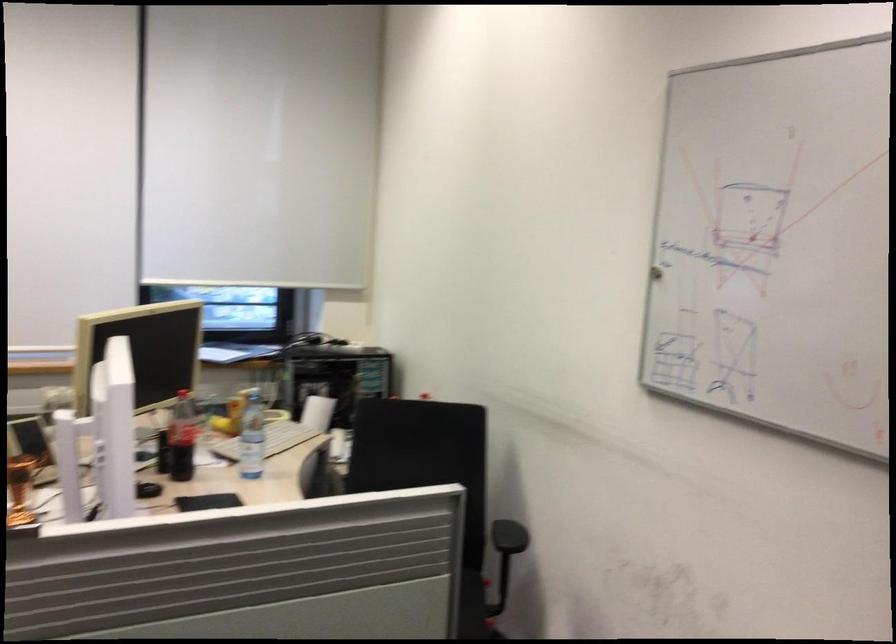
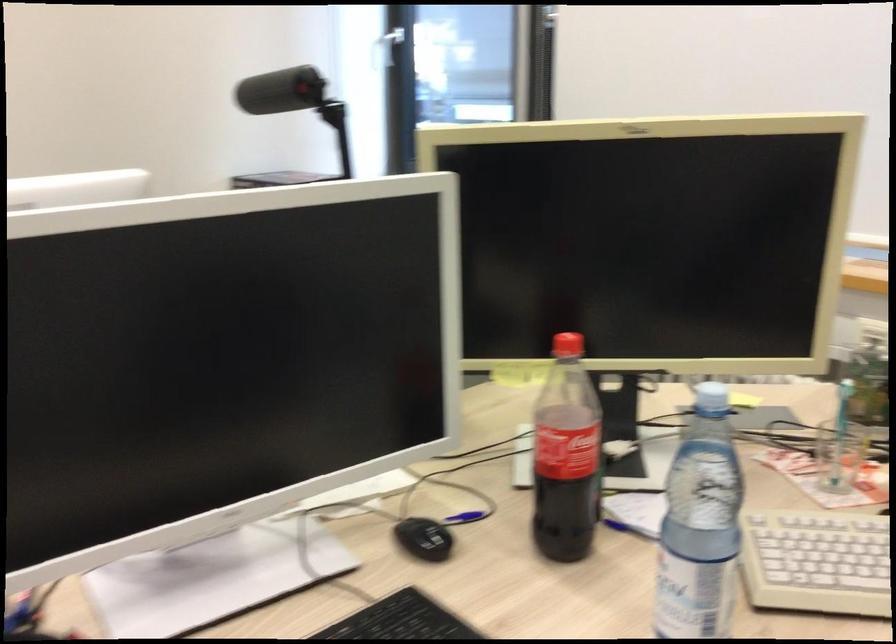
The point at [171,507] is marked in the first image. Where is the corresponding point in the second image?

(401, 620)